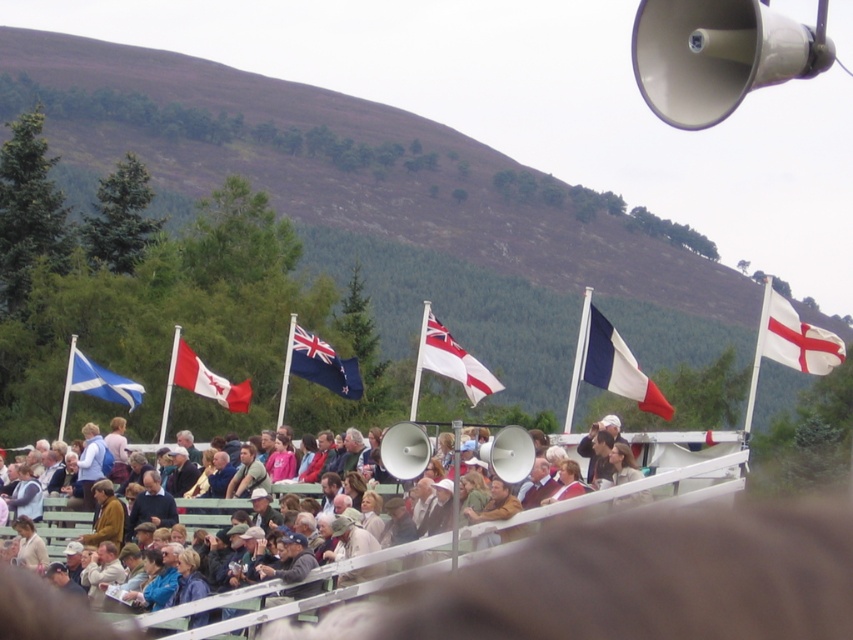
You are a photographer at the event and need to capture both the white plastic megaphone at upper right and the metallic silver megaphone at center in a single shot. Which megaphone should you position closer to the camera to ensure both are fully visible?

The white plastic megaphone at upper right is in front of the metallic silver megaphone at center, so positioning the white plastic megaphone at upper right closer to the camera will ensure both are fully visible.

You are a photographer at the event and need to capture a clear shot of the white fabric flag at center without the light brown leather jacket at center blocking it. What should you do?

The light brown leather jacket at center is bigger than the white fabric flag at center, so you should move your camera position to avoid the jacket blocking the flag.

What is the color and type of the clothing item located at the coordinate point [44,611] in the image?

The clothing item at point [44,611] is a light brown leather jacket.